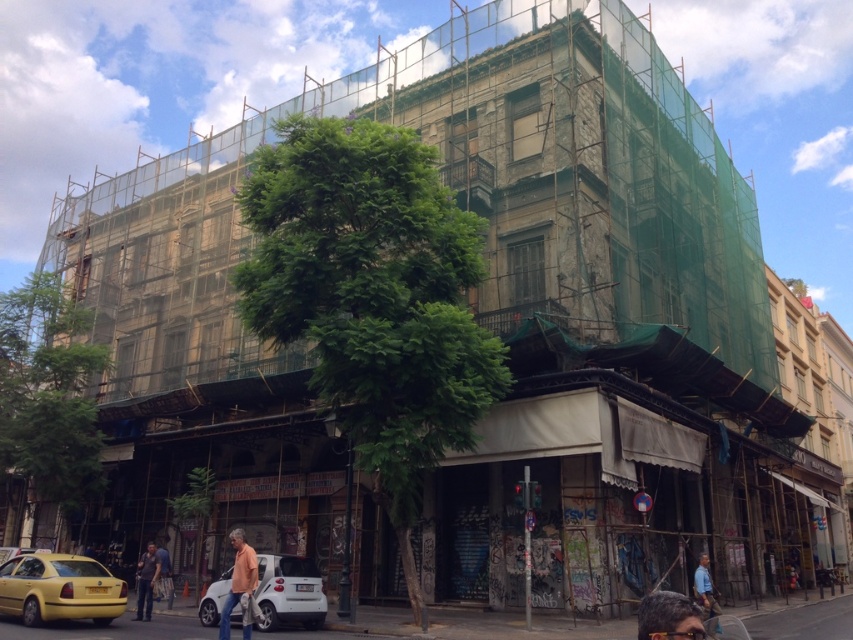
Question: Is the position of dark blue jeans at lower left more distant than that of blue shirt at lower right?

Choices:
 (A) yes
 (B) no

Answer: (A)

Question: Which point appears closest to the camera in this image?

Choices:
 (A) (700, 598)
 (B) (254, 582)

Answer: (B)

Question: Estimate the real-world distances between objects in this image. Which object is farther from the orange t-shirt at center?

Choices:
 (A) dark blue jeans at lower left
 (B) yellow matte taxi at lower left
 (C) white matte car at lower center
 (D) blue shirt at lower right

Answer: (D)

Question: Is white matte car at lower center above dark blue jeans at lower left?

Choices:
 (A) yes
 (B) no

Answer: (A)

Question: Is yellow matte taxi at lower left bigger than white matte car at lower center?

Choices:
 (A) no
 (B) yes

Answer: (B)

Question: Which object appears farthest from the camera in this image?

Choices:
 (A) blue shirt at lower right
 (B) dark brown hair at lower right

Answer: (A)